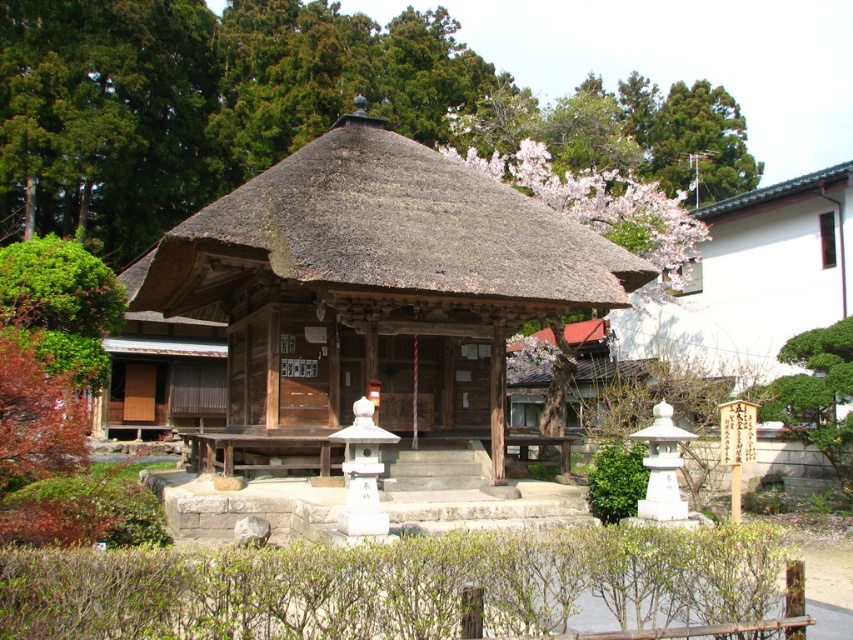
Which is more to the left, thatched straw roof at center or green leafy tree at upper center?

Positioned to the left is thatched straw roof at center.

Who is more forward, [306,177] or [701,134]?

Point [306,177] is in front.

Where is `thatched straw roof at center`? The height and width of the screenshot is (640, 853). thatched straw roof at center is located at coordinates (389, 230).